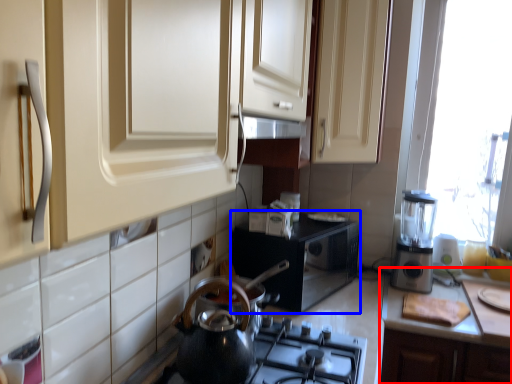
Question: Among these objects, which one is farthest to the camera, countertop (highlighted by a red box) or appliance (highlighted by a blue box)?

Choices:
 (A) countertop
 (B) appliance

Answer: (B)